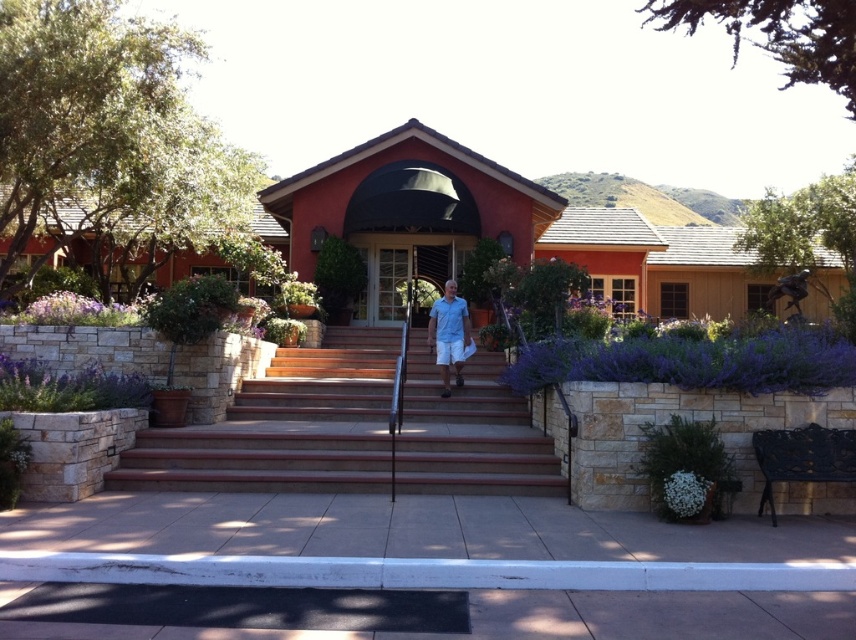
You are standing at the entrance of the building and want to know where the point at coordinates (449, 333) is located. According to the image description, where exactly is this point located?

The point at coordinates (449, 333) is located on the light blue fabric shirt at center.

You are a gardener who needs to replace the pots of the green leafy plant at lower right and the purple matte flower at lower left. Which pot requires a smaller size?

The green leafy plant at lower right requires a smaller pot since it has a smaller size compared to the purple matte flower at lower left.